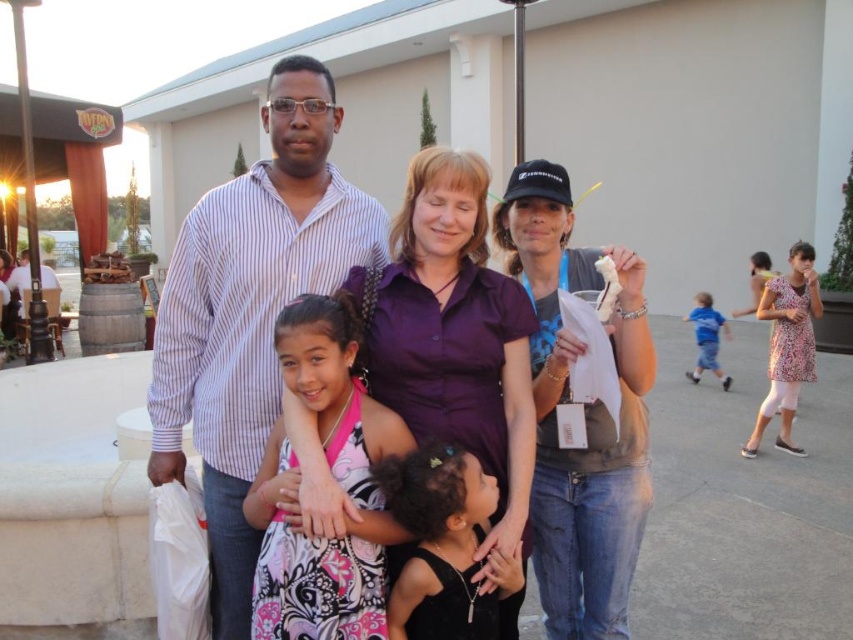
You are standing at the point labeled as point (250, 312). What object are you touching?

The point labeled as point (250, 312) is on the striped cotton shirt at center, so you are touching the striped cotton shirt at center.

You are organizing a photoshoot and need to place two outfits in the center of the frame. The purple smooth shirt at center and the pink satin dress at center must be positioned so that they don not overlap. Given their sizes, which outfit should be placed further back to ensure both are visible?

The purple smooth shirt at center has a larger width than the pink satin dress at center. To ensure both are visible without overlapping, the larger purple smooth shirt at center should be placed further back so the smaller pink satin dress at center can be positioned closer to the front.

In the scene shown: You are a photographer trying to capture a clear shot of the pink satin dress at center without the matte black shirt at center blocking it. Based on their positions, is this possible?

The matte black shirt at center is positioned over the pink satin dress at center, so it is blocking the view. To capture a clear shot of the pink satin dress at center, you would need to adjust the angle or have the matte black shirt at center move to avoid the obstruction.